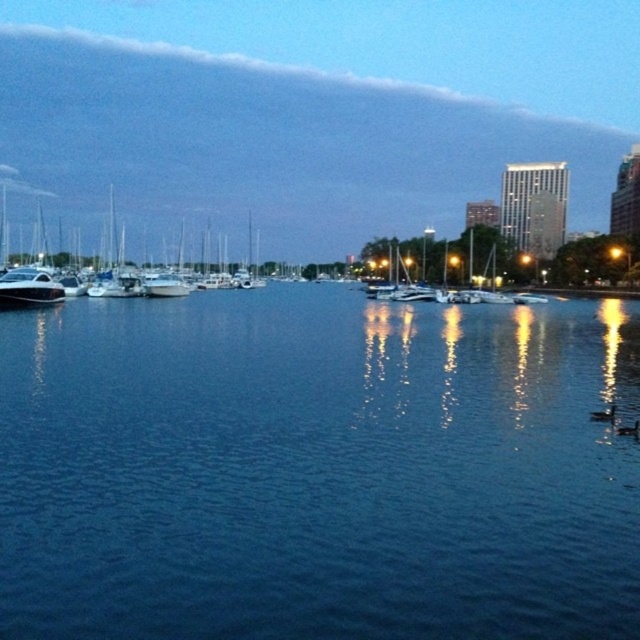
Between point (196, 406) and point (19, 280), which one is positioned behind?

Point (19, 280)

At what (x,y) coordinates should I click in order to perform the action: click on blue water at center. Please return your answer as a coordinate pair (x, y). Looking at the image, I should click on (317, 468).

Can you confirm if white glossy boat at left is positioned to the right of shiny white yacht at left?

Incorrect, white glossy boat at left is not on the right side of shiny white yacht at left.

Who is lower down, white glossy boat at left or shiny white yacht at left?

shiny white yacht at left is below.

Which is in front, point (195, 284) or point (19, 292)?

Positioned in front is point (19, 292).

This screenshot has height=640, width=640. Identify the location of white glossy boat at left. (122, 273).

Does blue water at center appear on the left side of white glossy boat at left?

Incorrect, blue water at center is not on the left side of white glossy boat at left.

You are a GUI agent. You are given a task and a screenshot of the screen. Output one action in this format:
    pyautogui.click(x=<x>, y=<y>)
    Task: Click on the blue water at center
    This screenshot has width=640, height=640.
    Given the screenshot: What is the action you would take?
    pyautogui.click(x=317, y=468)